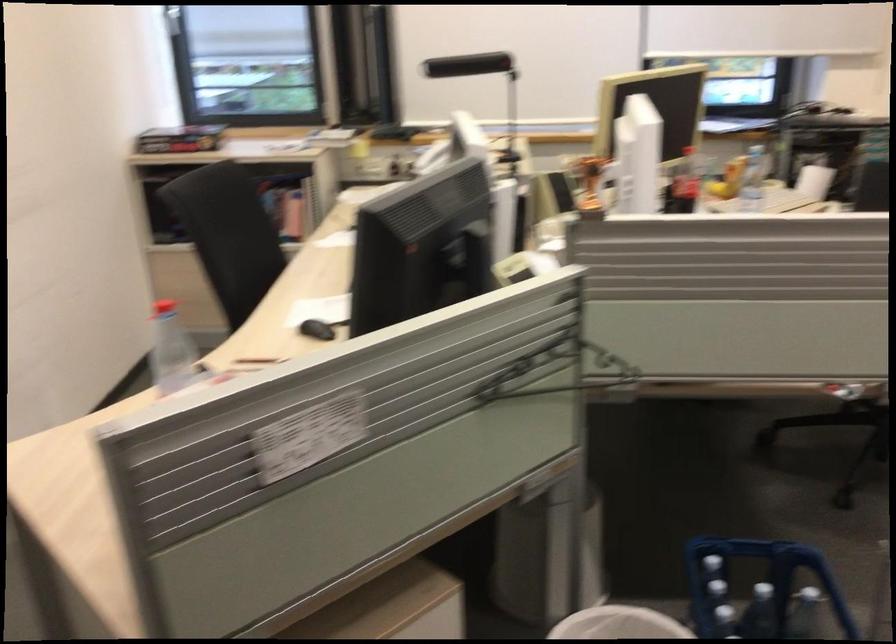
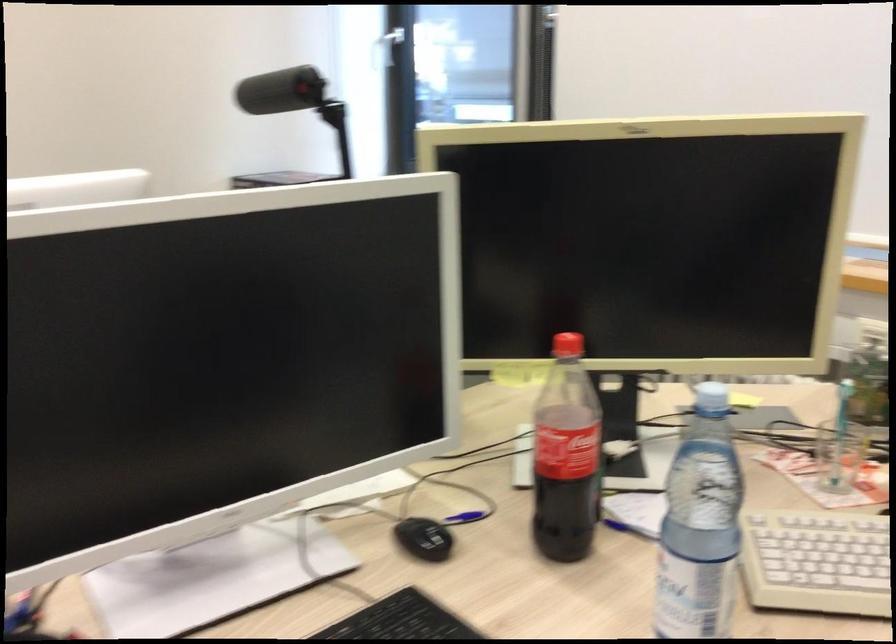
Locate, in the second image, the point that corresponds to point 684,185 in the first image.

(565, 456)